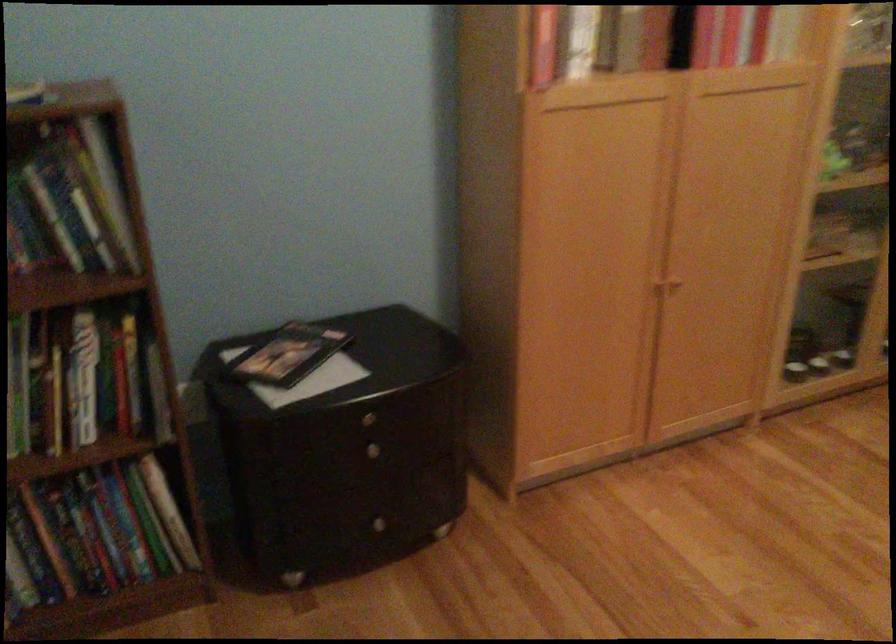
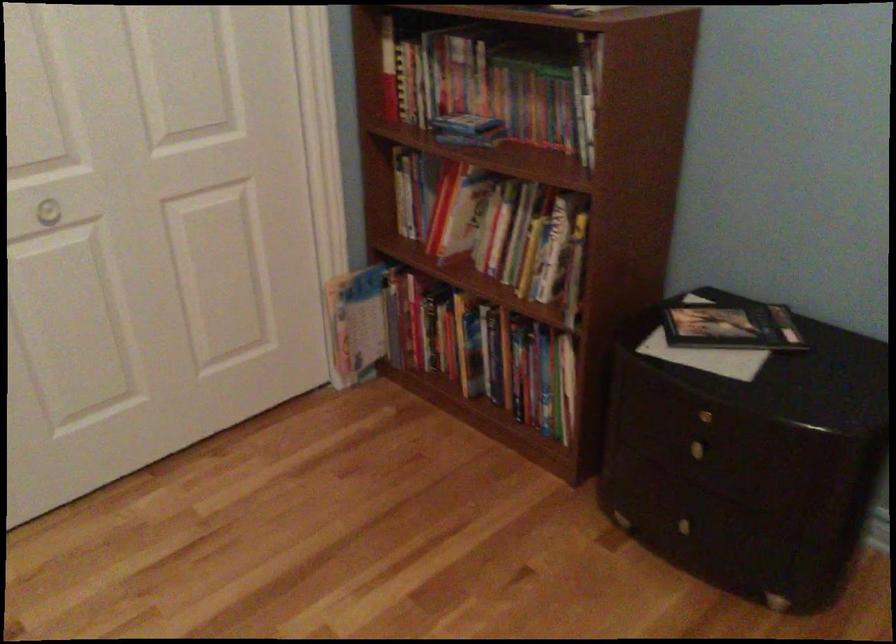
The point at (358, 462) is marked in the first image. Where is the corresponding point in the second image?

(686, 450)